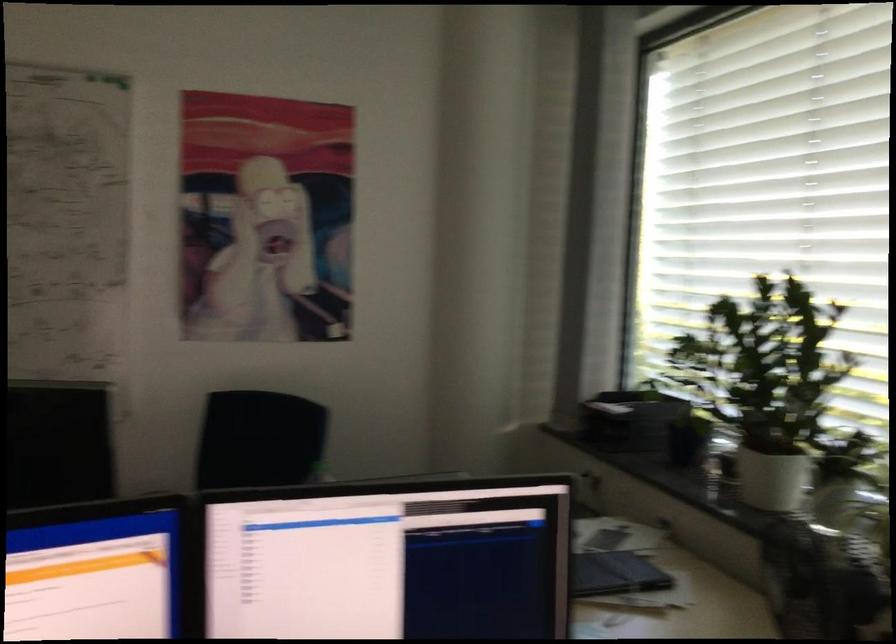
Describe the element at coordinates (770, 478) in the screenshot. I see `the white flower pot` at that location.